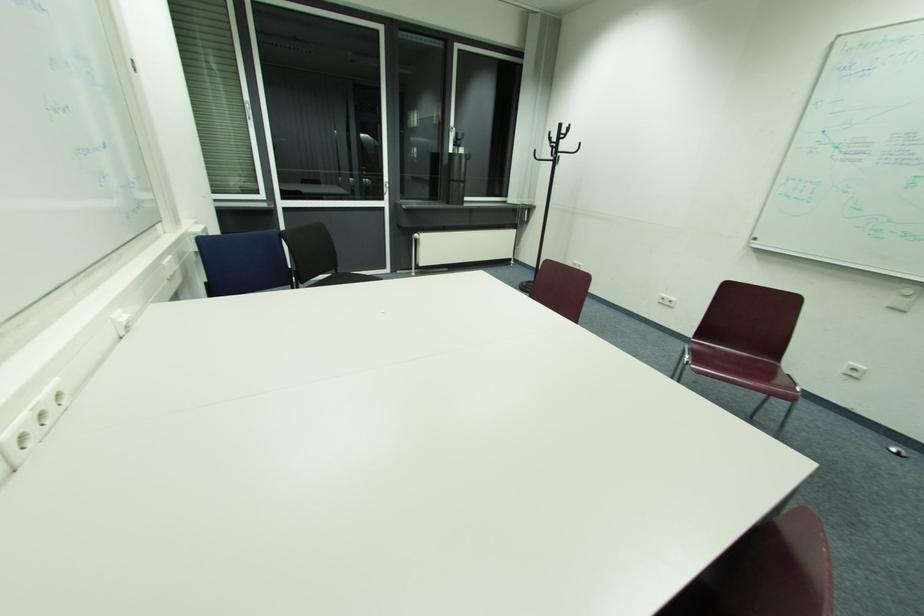
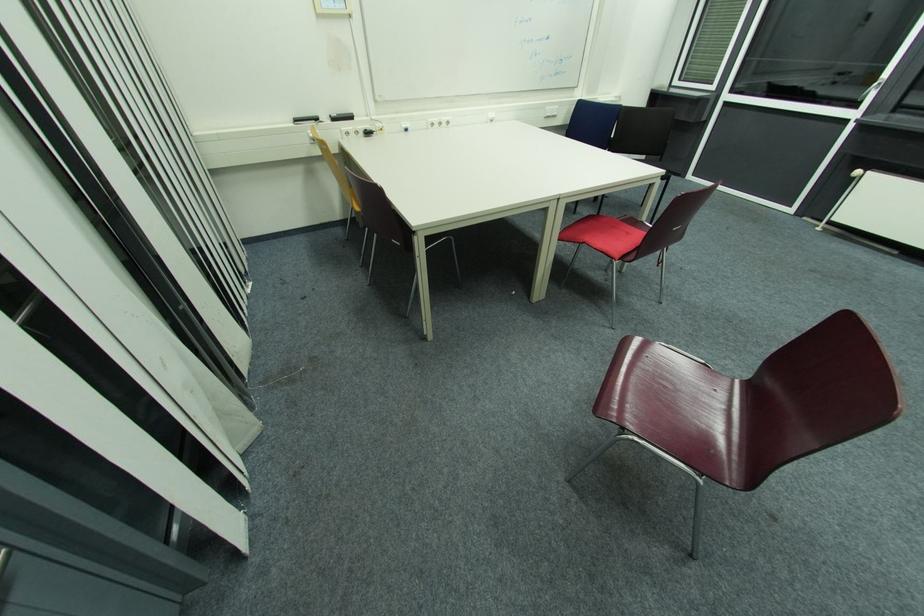
Locate, in the second image, the point that corresponds to point (384, 199) in the first image.

(859, 107)